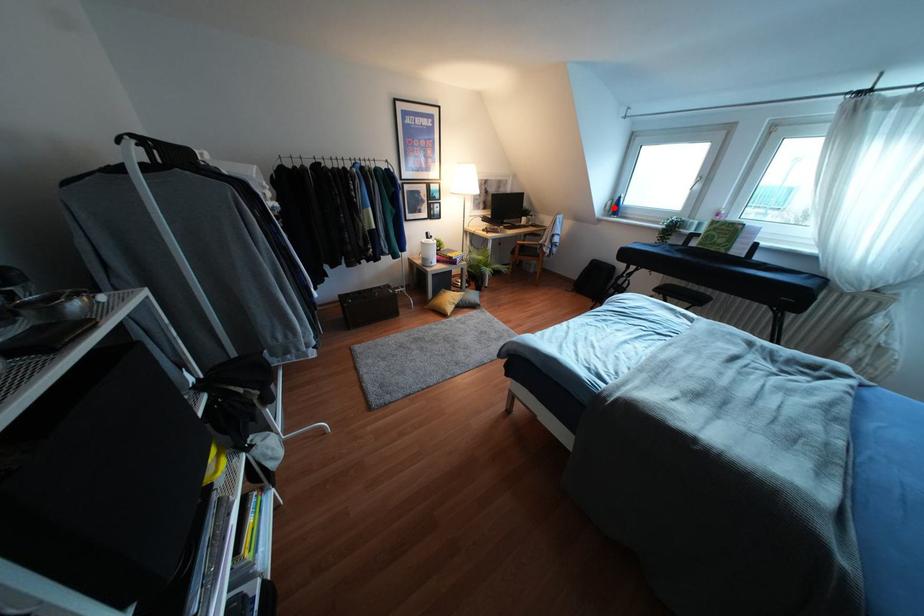
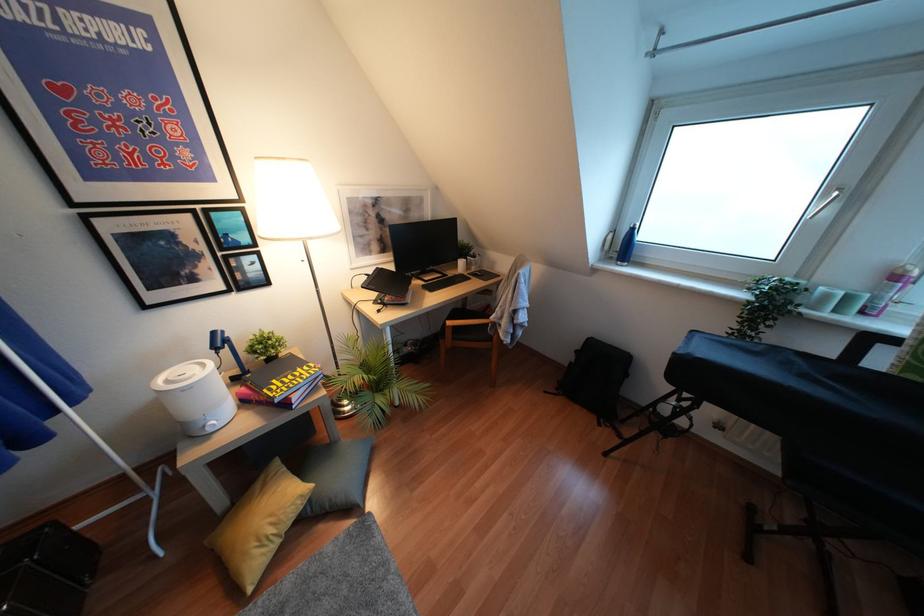
Question: I am providing you with two images of the same scene from different viewpoints. Given a red point in image1, look at the same physical point in image2. Is it:

Choices:
 (A) Closer to the viewpoint
 (B) Farther from the viewpoint

Answer: (B)